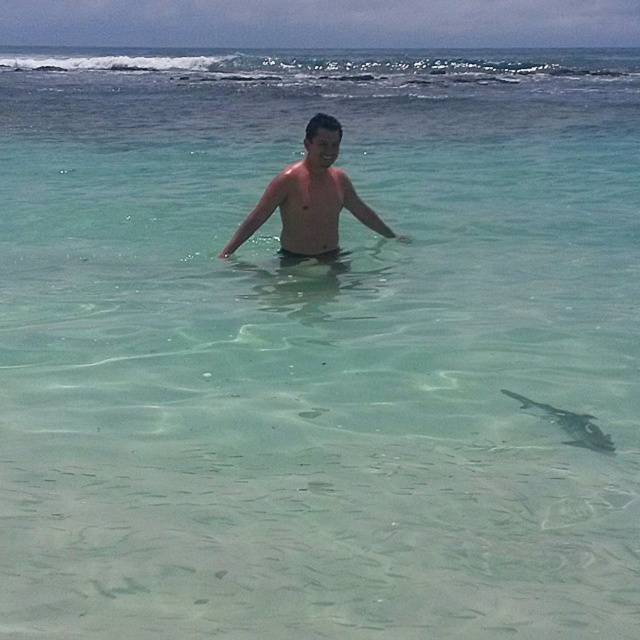
Measure the distance between point (324,237) and camera.

A distance of 8.57 meters exists between point (324,237) and camera.

This screenshot has width=640, height=640. Describe the element at coordinates (308, 198) in the screenshot. I see `shiny skin at center` at that location.

Does point (308, 200) lie behind point (317, 225)?

No, (308, 200) is closer to viewer.

Where is `shiny skin at center`? shiny skin at center is located at coordinates (308, 198).

Is point (289, 246) positioned in front of point (577, 435)?

No, (289, 246) is further to viewer.

Looking at this image, can you confirm if shiny skin at center is wider than translucent clear fish at lower right?

Indeed, shiny skin at center has a greater width compared to translucent clear fish at lower right.

Find the location of a particular element. shiny skin at center is located at coordinates (308, 198).

Can you confirm if smooth skin torso at center is bigger than translucent clear fish at lower right?

Correct, smooth skin torso at center is larger in size than translucent clear fish at lower right.

Does smooth skin torso at center have a lesser height compared to translucent clear fish at lower right?

No, smooth skin torso at center is not shorter than translucent clear fish at lower right.

The image size is (640, 640). What do you see at coordinates (308, 208) in the screenshot?
I see `smooth skin torso at center` at bounding box center [308, 208].

Where is `smooth skin torso at center`? The image size is (640, 640). smooth skin torso at center is located at coordinates (308, 208).